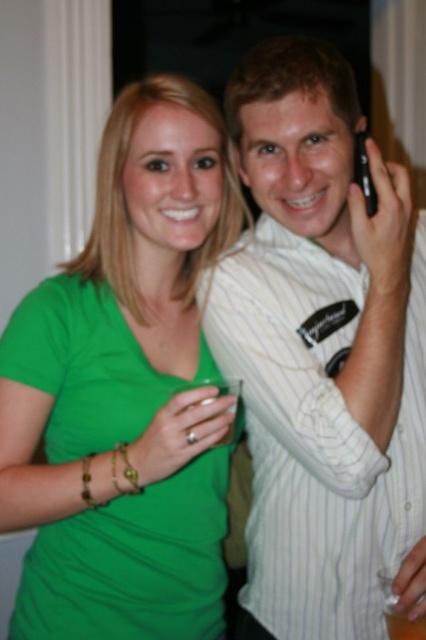
You are standing in a room and see two people. The first person is wearing a bright green V neck shirt and has long blonde hair. The second person is wearing a white striped shirt with a logo on the chest. There is a point at coordinate (x=126, y=390). Which person is this point closer to?

The point at coordinate (x=126, y=390) is on the green matte shirt at center, so it is closer to the first person wearing the bright green V neck shirt.

You are at a party and want to take a photo of the white striped shirt at upper right and the black plastic phone at upper right. Which object should you focus on first if you want to capture both in one frame without zooming in or out?

You should focus on the white striped shirt at upper right first because it is larger than the black plastic phone at upper right, so it will be more visible in the frame without needing to adjust the zoom.